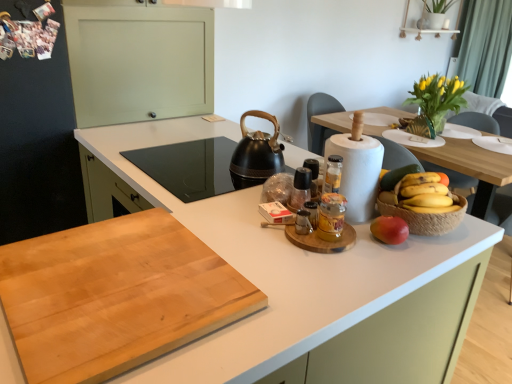
The image size is (512, 384). Identify the location of black rubberized kettle at center. click(256, 154).

At what (x,y) coordinates should I click in order to perform the action: click on translucent glass spice at center, which is the second bottle in front-to-back order. Please return your answer as a coordinate pair (x, y). Looking at the image, I should click on (301, 188).

What do you see at coordinates (485, 45) in the screenshot? This screenshot has height=384, width=512. I see `green fabric curtain at upper right` at bounding box center [485, 45].

Locate an element on the screen. The height and width of the screenshot is (384, 512). green fabric curtain at upper right is located at coordinates (485, 45).

Find the location of a particular element. The image size is (512, 384). green matte grapefruit at right is located at coordinates (422, 193).

The height and width of the screenshot is (384, 512). What do you see at coordinates (397, 176) in the screenshot?
I see `yellow matte bananas at right` at bounding box center [397, 176].

Measure the distance between point (381,186) and camera.

Point (381,186) is 1.33 meters from camera.

I want to click on translucent glass jar at center, which is counted as the 1th bottle, starting from the front, so click(x=331, y=216).

Is wooden bowl of fruit at center looking in the opposite direction of translucent glass jar at center, which is counted as the 1th bottle, starting from the front?

Correct, wooden bowl of fruit at center is looking away from translucent glass jar at center, which is counted as the 1th bottle, starting from the front.

Which point is more distant from viewer, (473,150) or (332,217)?

The point (473,150) is behind.

Is wooden bowl of fruit at center not within translucent glass jar at center, which is counted as the 1th bottle, starting from the front?

Yes, wooden bowl of fruit at center is not within translucent glass jar at center, which is counted as the 1th bottle, starting from the front.

Is wooden bowl of fruit at center not near translucent glass jar at center, which is the 2th bottle from back to front?

Yes, wooden bowl of fruit at center and translucent glass jar at center, which is the 2th bottle from back to front, are located far from each other.

Can you confirm if black rubberized kettle at center is bigger than yellow matte bananas at right?

Yes, black rubberized kettle at center is bigger than yellow matte bananas at right.

Which of these two, black rubberized kettle at center or yellow matte bananas at right, stands taller?

black rubberized kettle at center.

Considering the points (256, 164) and (385, 173), which point is in front, point (256, 164) or point (385, 173)?

Point (385, 173)

Is black rubberized kettle at center to the left or to the right of yellow matte bananas at right in the image?

From the image, it's evident that black rubberized kettle at center is to the left of yellow matte bananas at right.

Is natural wood cutting board at center, the second countertop from the bottom, shorter than translucent glass jar at center, which is the 2th bottle from back to front?

Indeed, natural wood cutting board at center, the second countertop from the bottom, has a lesser height compared to translucent glass jar at center, which is the 2th bottle from back to front.

Measure the distance from natural wood cutting board at center, arranged as the 1th countertop when viewed from the top, to translucent glass jar at center, which is counted as the 1th bottle, starting from the front.

20.35 inches.

From the image's perspective, does natural wood cutting board at center, the second countertop from the bottom, appear higher than translucent glass jar at center, which is the 2th bottle from back to front?

Incorrect, from the image's perspective, natural wood cutting board at center, the second countertop from the bottom, is lower than translucent glass jar at center, which is the 2th bottle from back to front.

Can translucent glass jar at center, which is counted as the 1th bottle, starting from the front, be found inside natural wood cutting board at center, the second countertop from the bottom?

No, translucent glass jar at center, which is counted as the 1th bottle, starting from the front, is not inside natural wood cutting board at center, the second countertop from the bottom.

Is yellow matte bananas at right wider or thinner than wooden bowl of fruit at center?

Considering their sizes, yellow matte bananas at right looks slimmer than wooden bowl of fruit at center.

Find the location of a particular element. This screenshot has height=384, width=512. table below the yellow matte bananas at right (from a real-world perspective) is located at coordinates (472, 167).

Is yellow matte bananas at right placed right next to wooden bowl of fruit at center?

No, yellow matte bananas at right is not making contact with wooden bowl of fruit at center.

Is point (383, 175) closer or farther from the camera than point (492, 197)?

Clearly, point (383, 175) is closer to the camera than point (492, 197).

What's the angular difference between translucent glass jar at center, which is the 2th bottle from back to front, and white matte countertop at center, acting as the first countertop starting from the bottom,'s facing directions?

89.5 degrees.

Is white matte countertop at center, the second countertop positioned from the top, completely or partially inside translucent glass jar at center, which is the 2th bottle from back to front?

No, white matte countertop at center, the second countertop positioned from the top, is not a part of translucent glass jar at center, which is the 2th bottle from back to front.

There is a translucent glass jar at center, which is counted as the 1th bottle, starting from the front. In order to click on the 2nd countertop below it (from the image's perspective) in this screenshot , I will do `click(144, 143)`.

Does translucent glass jar at center, which is the 2th bottle from back to front, turn towards white matte countertop at center, acting as the first countertop starting from the bottom?

No, translucent glass jar at center, which is the 2th bottle from back to front, does not turn towards white matte countertop at center, acting as the first countertop starting from the bottom.

From a real-world perspective, between translucent glass spice at center, the first bottle positioned from the back, and white matte countertop at center, acting as the first countertop starting from the bottom, who is vertically lower?

white matte countertop at center, acting as the first countertop starting from the bottom, from a real-world perspective.

Consider the image. Is translucent glass spice at center, which is the second bottle in front-to-back order, turned away from white matte countertop at center, the second countertop positioned from the top?

No, translucent glass spice at center, which is the second bottle in front-to-back order, is not facing the opposite direction of white matte countertop at center, the second countertop positioned from the top.

Which is farther from the camera, [297,180] or [174,130]?

The point [174,130] is behind.

In terms of size, does translucent glass spice at center, the first bottle positioned from the back, appear bigger or smaller than white matte countertop at center, acting as the first countertop starting from the bottom?

Considering their sizes, translucent glass spice at center, the first bottle positioned from the back, takes up less space than white matte countertop at center, acting as the first countertop starting from the bottom.

Which of these two, yellow matte bananas at right or white matte countertop at center, the second countertop positioned from the top, is bigger?

With larger size is white matte countertop at center, the second countertop positioned from the top.

Based on the photo, how distant is yellow matte bananas at right from white matte countertop at center, the second countertop positioned from the top?

yellow matte bananas at right is 1.11 meters from white matte countertop at center, the second countertop positioned from the top.

Between yellow matte bananas at right and white matte countertop at center, the second countertop positioned from the top, which one appears on the right side from the viewer's perspective?

Positioned to the right is yellow matte bananas at right.

Is yellow matte bananas at right wider or thinner than white matte countertop at center, the second countertop positioned from the top?

In the image, yellow matte bananas at right appears to be more narrow than white matte countertop at center, the second countertop positioned from the top.

Where is `the 1st bottle to the left of the wooden bowl of fruit at center, starting your count from the anchor`? This screenshot has width=512, height=384. the 1st bottle to the left of the wooden bowl of fruit at center, starting your count from the anchor is located at coordinates (331, 216).

Image resolution: width=512 pixels, height=384 pixels. In order to click on kitchen appliance behind the yellow matte bananas at right in this screenshot , I will do `click(256, 154)`.

Based on their spatial positions, is wooden bowl of fruit at center or yellow matte bananas at right further from translucent glass spice at center, the first bottle positioned from the back?

Among the two, wooden bowl of fruit at center is located further to translucent glass spice at center, the first bottle positioned from the back.

Which object lies further to the anchor point green matte grapefruit at right, translucent glass spice at center, which is the second bottle in front-to-back order, or wooden bowl of fruit at center?

Among the two, wooden bowl of fruit at center is located further to green matte grapefruit at right.

From the image, which object appears to be nearer to yellow matte bananas at right, white matte countertop at center, the second countertop positioned from the top, or translucent glass jar at center, which is the 2th bottle from back to front?

Based on the image, translucent glass jar at center, which is the 2th bottle from back to front, appears to be nearer to yellow matte bananas at right.

Looking at the image, which one is located further to translucent glass jar at center, which is the 2th bottle from back to front, white matte countertop at center, acting as the first countertop starting from the bottom, or red matte apple at right?

The object further to translucent glass jar at center, which is the 2th bottle from back to front, is white matte countertop at center, acting as the first countertop starting from the bottom.

Based on their spatial positions, is green fabric curtain at upper right or natural wood cutting board at center, arranged as the 1th countertop when viewed from the top, further from translucent glass spice at center, which is the second bottle in front-to-back order?

green fabric curtain at upper right.

Looking at the image, which one is located further to translucent glass jar at center, which is the 2th bottle from back to front, green fabric curtain at upper right or green matte grapefruit at right?

Based on the image, green fabric curtain at upper right appears to be further to translucent glass jar at center, which is the 2th bottle from back to front.

When comparing their distances from green matte grapefruit at right, does green fabric curtain at upper right or red matte apple at right seem closer?

Based on the image, red matte apple at right appears to be nearer to green matte grapefruit at right.

Which object lies nearer to the anchor point yellow matte bananas at right, natural wood cutting board at center, the second countertop from the bottom, or green fabric curtain at upper right?

The object closer to yellow matte bananas at right is natural wood cutting board at center, the second countertop from the bottom.

You are a GUI agent. You are given a task and a screenshot of the screen. Output one action in this format:
    pyautogui.click(x=<x>, y=<y>)
    Task: Click on the table between translucent glass jar at center, which is counted as the 1th bottle, starting from the front, and green fabric curtain at upper right in the front-back direction
    
    Given the screenshot: What is the action you would take?
    pyautogui.click(x=472, y=167)

Image resolution: width=512 pixels, height=384 pixels. Identify the location of apple between natural wood cutting board at center, the second countertop from the bottom, and wooden bowl of fruit at center from front to back. tap(389, 229).

The width and height of the screenshot is (512, 384). I want to click on countertop between white matte countertop at center, the second countertop positioned from the top, and wooden bowl of fruit at center, along the z-axis, so click(115, 296).

You are a GUI agent. You are given a task and a screenshot of the screen. Output one action in this format:
    pyautogui.click(x=<x>, y=<y>)
    Task: Click on the grapefruit between yellow matte bananas at right and red matte apple at right from top to bottom
    
    Given the screenshot: What is the action you would take?
    pyautogui.click(x=422, y=193)